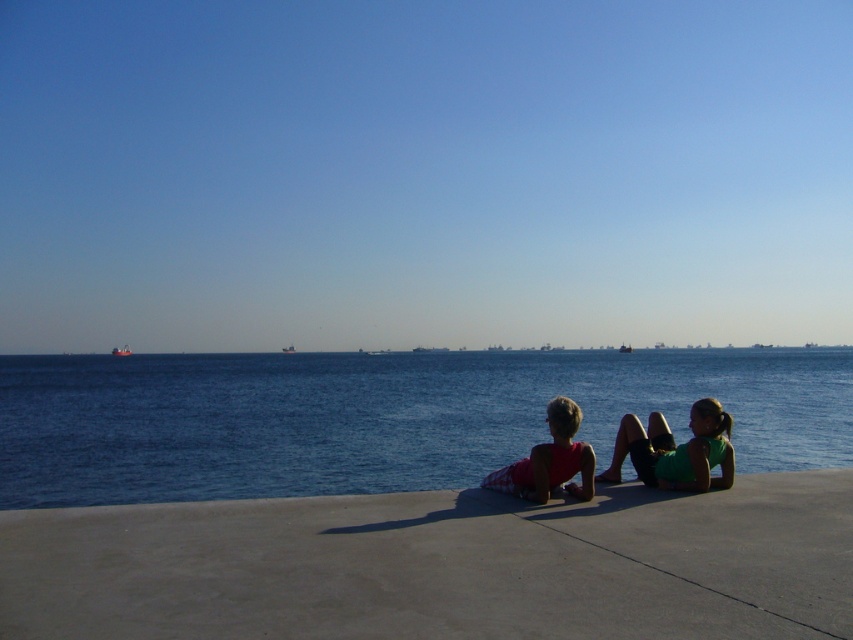
Question: Which object is positioned closest to the green fabric shorts at lower right?

Choices:
 (A) matte pink shorts at center
 (B) matte pink tank top at center
 (C) concretesmooth/solidconcrete at lower center
 (D) blue water at center

Answer: (A)

Question: Can you confirm if blue water at center is thinner than matte pink shorts at center?

Choices:
 (A) yes
 (B) no

Answer: (B)

Question: Which object is positioned closest to the green fabric shorts at lower right?

Choices:
 (A) concretesmooth/solidconcrete at lower center
 (B) matte pink shorts at center
 (C) blue water at center

Answer: (B)

Question: Is blue water at center thinner than matte pink shorts at center?

Choices:
 (A) yes
 (B) no

Answer: (B)

Question: Which object is the farthest from the blue water at center?

Choices:
 (A) concretesmooth/solidconcrete at lower center
 (B) matte pink tank top at center

Answer: (A)

Question: Is blue water at center to the left of matte pink shorts at center from the viewer's perspective?

Choices:
 (A) no
 (B) yes

Answer: (B)